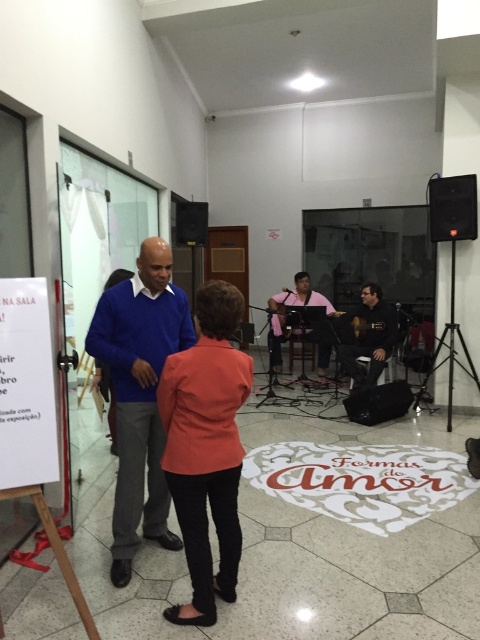
Question: Which is farther from the blue sweater at center?

Choices:
 (A) matte black guitar at center
 (B) black plastic speaker at upper center
 (C) matte pink shirt at center
 (D) black fabric speaker at lower right

Answer: (B)

Question: Is wooden acoustic guitar at center closer to camera compared to black plastic speaker at upper center?

Choices:
 (A) yes
 (B) no

Answer: (A)

Question: Can you confirm if blue sweater at center is bigger than black plastic speaker at upper center?

Choices:
 (A) yes
 (B) no

Answer: (A)

Question: Which point appears closest to the camera in this image?

Choices:
 (A) (197, 458)
 (B) (370, 410)

Answer: (A)

Question: Which object is farther from the camera taking this photo?

Choices:
 (A) black plastic speaker at upper center
 (B) black matte speaker at upper right
 (C) blue sweater at center

Answer: (A)

Question: Is matte orange blazer at center behind matte black guitar at center?

Choices:
 (A) yes
 (B) no

Answer: (B)